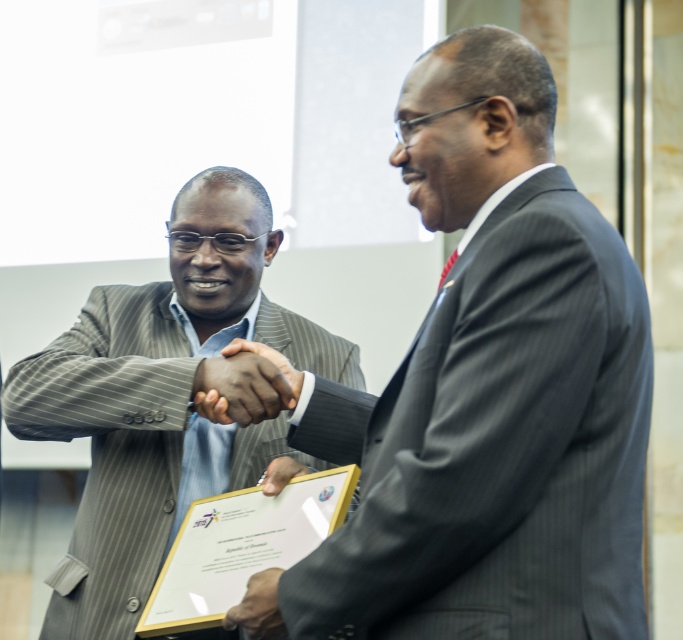
Question: Estimate the real-world distances between objects in this image. Which object is farther from the black leather hand at center?

Choices:
 (A) matte gray suit at center
 (B) matte black hand at center
 (C) black matte hand at center

Answer: (A)

Question: Can you confirm if black leather hand at center is bigger than black matte hand at center?

Choices:
 (A) yes
 (B) no

Answer: (A)

Question: Which object appears farthest from the camera in this image?

Choices:
 (A) dark brown leather hand at center
 (B) matte black hand at center

Answer: (B)

Question: Which of the following is the farthest from the observer?

Choices:
 (A) (130, 557)
 (B) (223, 397)

Answer: (A)

Question: Is dark brown leather hand at center to the left of black matte hand at center from the viewer's perspective?

Choices:
 (A) no
 (B) yes

Answer: (A)

Question: Is black leather hand at center closer to camera compared to dark brown leather hand at center?

Choices:
 (A) yes
 (B) no

Answer: (B)